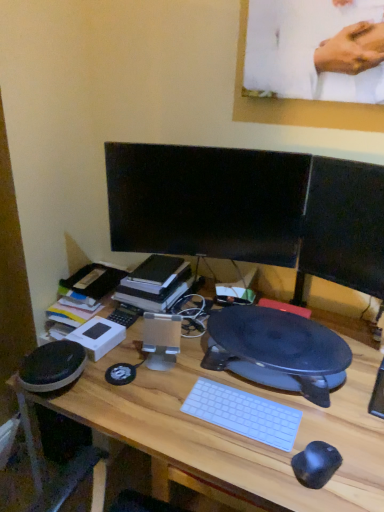
Question: Should I look upward or downward to see hardcover book at center?

Choices:
 (A) up
 (B) down

Answer: (B)

Question: From the image's perspective, is hardcover book at center below black glossy monitor at center, which is the 2th computer monitor in right-to-left order?

Choices:
 (A) no
 (B) yes

Answer: (B)

Question: From a real-world perspective, is hardcover book at center physically below black glossy monitor at center, which is the 2th computer monitor in right-to-left order?

Choices:
 (A) yes
 (B) no

Answer: (A)

Question: Is black glossy monitor at center, which is the 2th computer monitor in right-to-left order, completely or partially inside hardcover book at center?

Choices:
 (A) no
 (B) yes

Answer: (A)

Question: Is hardcover book at center taller than black glossy monitor at center, which is the 2th computer monitor in right-to-left order?

Choices:
 (A) yes
 (B) no

Answer: (B)

Question: Is hardcover book at center wider than black glossy monitor at center, which is the 2th computer monitor in right-to-left order?

Choices:
 (A) yes
 (B) no

Answer: (A)

Question: Is hardcover book at center smaller than black glossy monitor at center, which is the 2th computer monitor in right-to-left order?

Choices:
 (A) no
 (B) yes

Answer: (B)

Question: From a real-world perspective, does wooden desk at center sit lower than hardcover book at center?

Choices:
 (A) no
 (B) yes

Answer: (A)

Question: Is the depth of wooden desk at center less than that of hardcover book at center?

Choices:
 (A) yes
 (B) no

Answer: (A)

Question: Is wooden desk at center next to hardcover book at center and touching it?

Choices:
 (A) yes
 (B) no

Answer: (B)

Question: Is wooden desk at center bigger than hardcover book at center?

Choices:
 (A) yes
 (B) no

Answer: (A)

Question: Is hardcover book at center located within wooden desk at center?

Choices:
 (A) yes
 (B) no

Answer: (B)

Question: Could you tell me if wooden desk at center is facing hardcover book at center?

Choices:
 (A) yes
 (B) no

Answer: (A)

Question: Can you confirm if black glossy monitor at center, arranged as the first computer monitor when viewed from the left, is thinner than hardcover book at center?

Choices:
 (A) no
 (B) yes

Answer: (B)